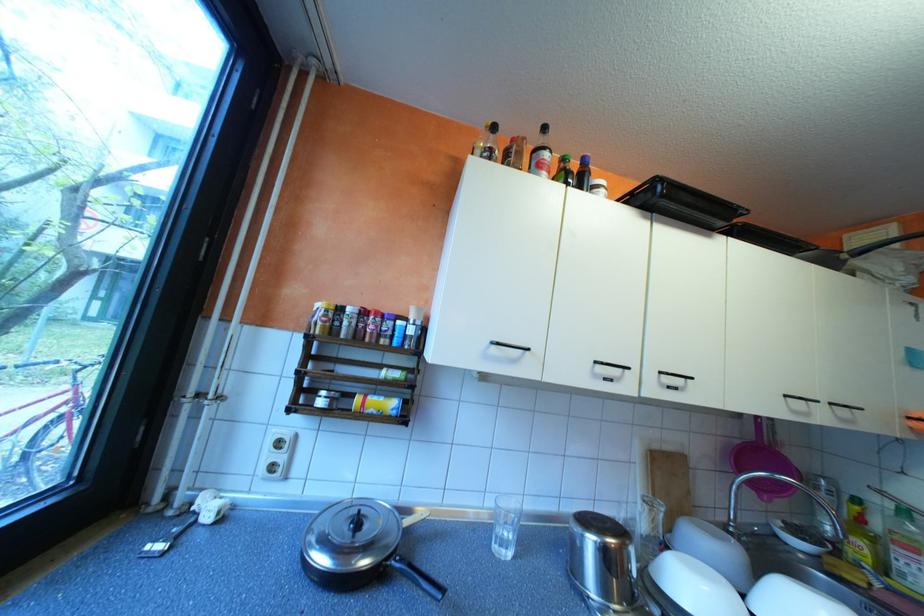
Describe the element at coordinates (418, 577) in the screenshot. I see `the pan handle` at that location.